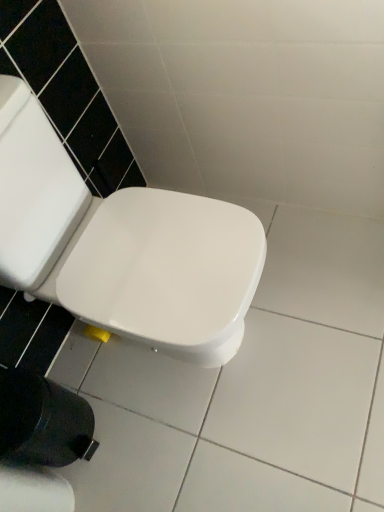
Where is `free space in front of white glossy toilet seat at center`? The width and height of the screenshot is (384, 512). free space in front of white glossy toilet seat at center is located at coordinates (225, 436).